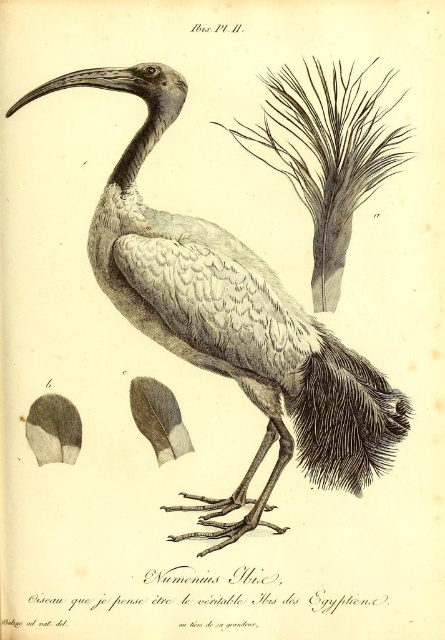
Is gray feathered bird at center below dark gray textured feathers at lower right?

Incorrect, gray feathered bird at center is not positioned below dark gray textured feathers at lower right.

Who is more distant from viewer, (372, 474) or (315, 372)?

The point (315, 372) is more distant.

In order to click on gray feathered bird at center in this screenshot , I will do 231,321.